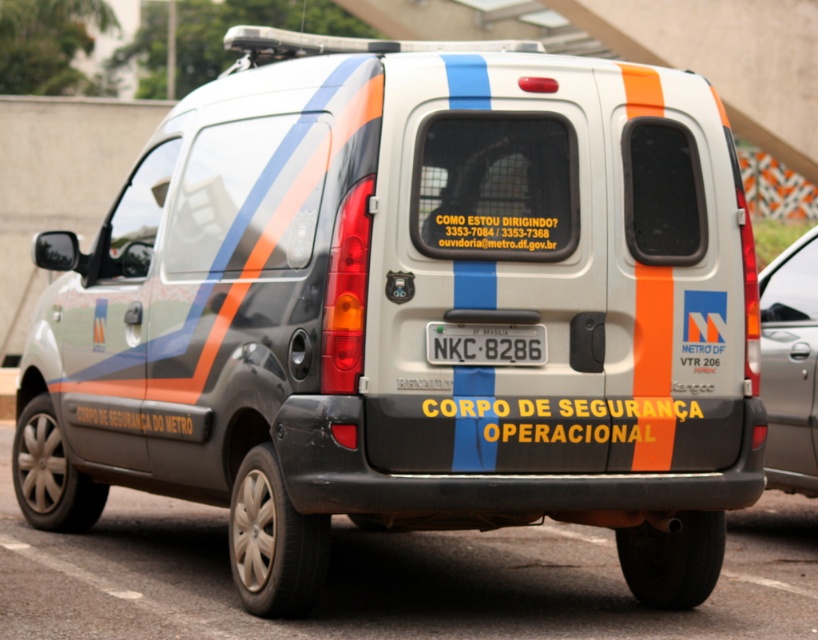
Question: Which object is farther from the camera taking this photo?

Choices:
 (A) white plastic license plate at center
 (B) metallic gray van at right

Answer: (B)

Question: Which point is closer to the camera taking this photo?

Choices:
 (A) (798, 420)
 (B) (486, 336)

Answer: (B)

Question: Does metallic gray van at right appear on the left side of white plastic license plate at center?

Choices:
 (A) no
 (B) yes

Answer: (A)

Question: Does metallic gray van at right have a larger size compared to white plastic license plate at center?

Choices:
 (A) yes
 (B) no

Answer: (A)

Question: Does metallic gray van at right have a lesser width compared to white plastic license plate at center?

Choices:
 (A) no
 (B) yes

Answer: (B)